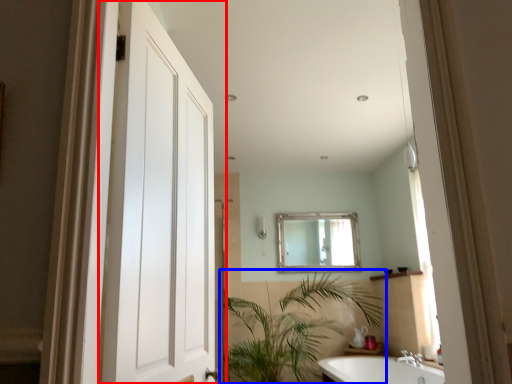
Question: Which object appears farthest to the camera in this image, door (highlighted by a red box) or houseplant (highlighted by a blue box)?

Choices:
 (A) door
 (B) houseplant

Answer: (B)